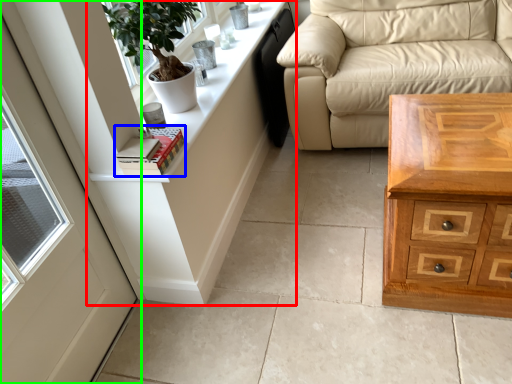
Question: Which object is positioned farthest from dresser (highlighted by a red box)? Select from book (highlighted by a blue box) and door (highlighted by a green box).

Choices:
 (A) book
 (B) door

Answer: (B)